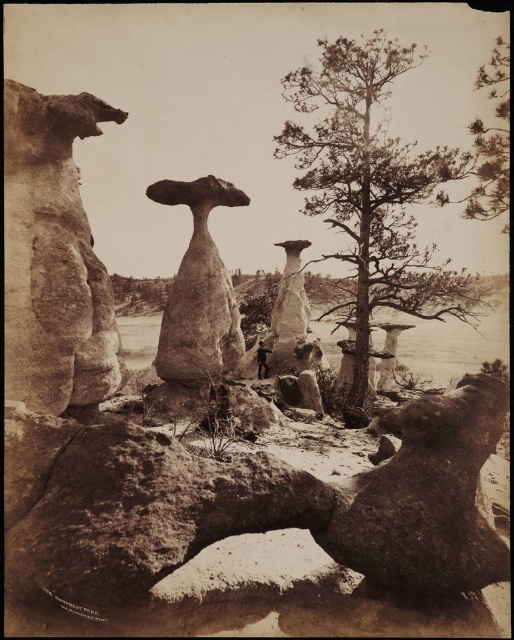
You are standing at the entrance of the natural archway in the foreground. Which direction should you walk to reach the green textured tree at center?

The green textured tree at center is located at point coordinates that are to the north of your current position at the natural archway entrance. Therefore, you should walk north to reach it.

Based on the scene description and the given coordinates, what type of rock formation is located at point (53, 257)?

The point (53, 257) indicates a smooth sandstone toadstool at the left.